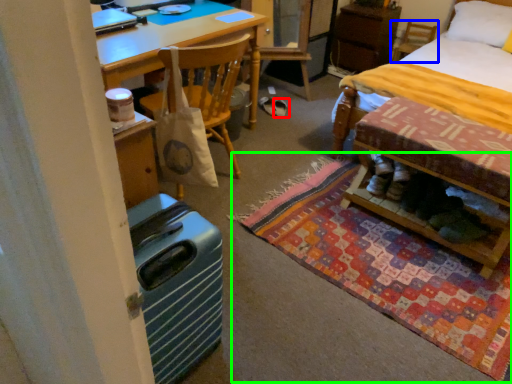
Question: Based on their relative distances, which object is nearer to footwear (highlighted by a red box)? Choose from chair (highlighted by a blue box) and mat (highlighted by a green box).

Choices:
 (A) chair
 (B) mat

Answer: (B)